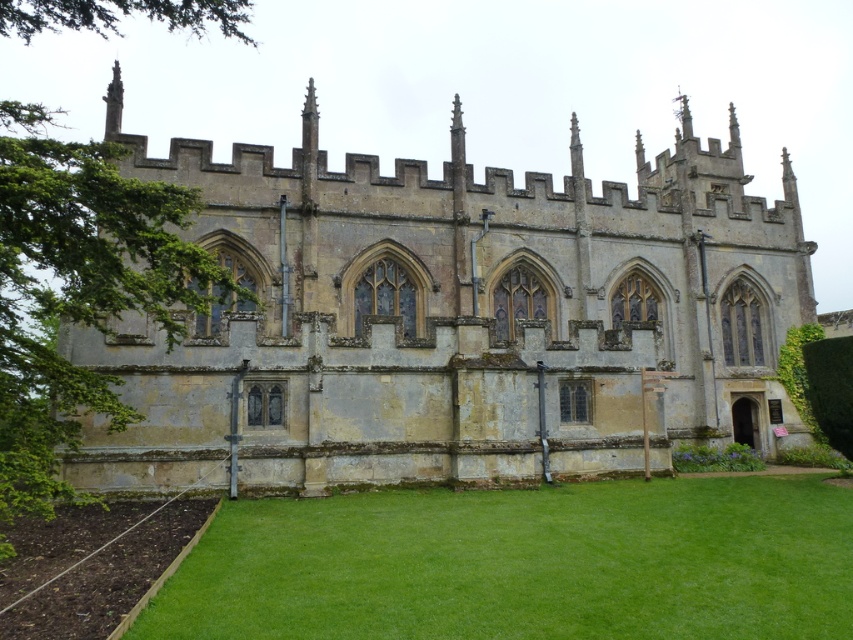
You are standing on the lawn in front of the stone church at center. If you face the church, where would you expect to find the main entrance? Is it on the left side, right side, or directly in front of you?

The main entrance of the stone church at center is typically located directly in front of you, as the main entrance in Gothic architecture is often centrally positioned on the facade.

Based on the photo, you are a landscape architect designing a new garden for the property. You need to place a statue that is 2 meters tall between the stone church at center and the green grass at lower center. Considering their sizes, which object will the statue appear closer in size to when viewed from the front?

The statue will appear closer in size to the green grass at lower center because the stone church at center is much larger in size, making the statue seem smaller in comparison.